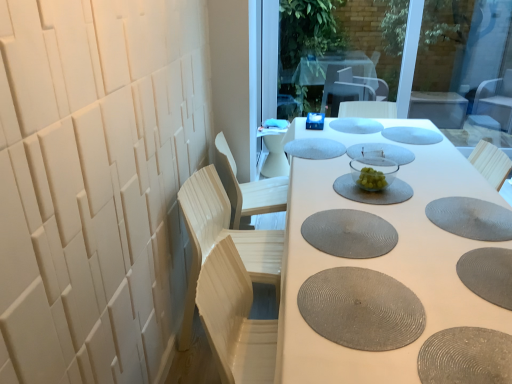
The width and height of the screenshot is (512, 384). I want to click on empty space that is ontop of gray textured placemat at center, the ninth manhole cover when ordered from back to front (from a real-world perspective), so click(x=355, y=299).